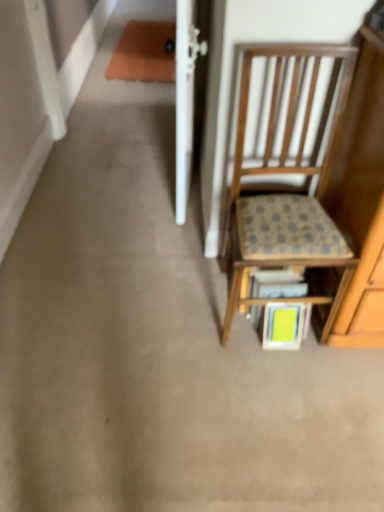
Question: Does wooden chair with cushion at right come behind wooden textured shelf at center?

Choices:
 (A) no
 (B) yes

Answer: (A)

Question: Is wooden chair with cushion at right aimed at wooden textured shelf at center?

Choices:
 (A) no
 (B) yes

Answer: (B)

Question: Is wooden chair with cushion at right shorter than wooden textured shelf at center?

Choices:
 (A) yes
 (B) no

Answer: (B)

Question: Does wooden chair with cushion at right have a greater height compared to wooden textured shelf at center?

Choices:
 (A) no
 (B) yes

Answer: (B)

Question: Considering the relative sizes of wooden chair with cushion at right and wooden textured shelf at center in the image provided, is wooden chair with cushion at right thinner than wooden textured shelf at center?

Choices:
 (A) no
 (B) yes

Answer: (A)

Question: Does wooden chair with cushion at right lie in front of wooden textured shelf at center?

Choices:
 (A) no
 (B) yes

Answer: (B)

Question: From a real-world perspective, does wooden textured shelf at center stand above green matte book at lower center?

Choices:
 (A) yes
 (B) no

Answer: (A)

Question: Are wooden textured shelf at center and green matte book at lower center making contact?

Choices:
 (A) no
 (B) yes

Answer: (A)

Question: Would you say wooden textured shelf at center is outside green matte book at lower center?

Choices:
 (A) no
 (B) yes

Answer: (B)

Question: Can you confirm if wooden textured shelf at center is bigger than green matte book at lower center?

Choices:
 (A) yes
 (B) no

Answer: (A)

Question: Would you say wooden textured shelf at center is a long distance from green matte book at lower center?

Choices:
 (A) yes
 (B) no

Answer: (B)

Question: Considering the relative sizes of wooden textured shelf at center and green matte book at lower center in the image provided, is wooden textured shelf at center smaller than green matte book at lower center?

Choices:
 (A) no
 (B) yes

Answer: (A)

Question: Does wooden chair with cushion at right have a greater height compared to green matte book at lower center?

Choices:
 (A) no
 (B) yes

Answer: (B)